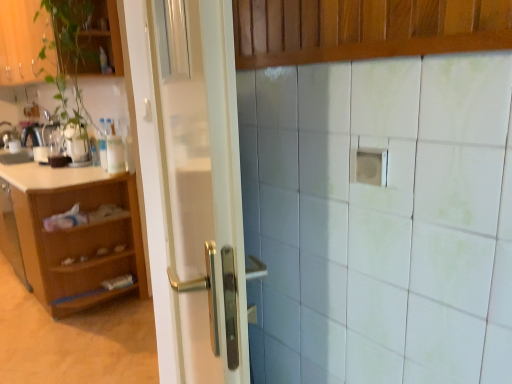
Question: From a real-world perspective, does green matte plant at upper left, acting as the 1th cabinetry starting from the top, sit lower than white glossy pot at left?

Choices:
 (A) no
 (B) yes

Answer: (A)

Question: Is green matte plant at upper left, which is the third cabinetry in bottom-to-top order, aimed at white glossy pot at left?

Choices:
 (A) no
 (B) yes

Answer: (A)

Question: Does green matte plant at upper left, which is the third cabinetry in bottom-to-top order, have a smaller size compared to white glossy pot at left?

Choices:
 (A) no
 (B) yes

Answer: (A)

Question: Does green matte plant at upper left, the second cabinetry in the back-to-front sequence, have a greater height compared to white glossy pot at left?

Choices:
 (A) no
 (B) yes

Answer: (B)

Question: Is white glossy pot at left located within green matte plant at upper left, which is counted as the second cabinetry, starting from the front?

Choices:
 (A) yes
 (B) no

Answer: (B)

Question: Would you consider green matte plant at upper left, the second cabinetry in the back-to-front sequence, to be distant from white glossy pot at left?

Choices:
 (A) no
 (B) yes

Answer: (A)

Question: From the image's perspective, would you say white glossy door at center is shown under wooden paneling at upper center, the 3th cabinetry when ordered from back to front?

Choices:
 (A) no
 (B) yes

Answer: (B)

Question: Can you confirm if white glossy door at center is thinner than wooden paneling at upper center, the 3th cabinetry when ordered from back to front?

Choices:
 (A) yes
 (B) no

Answer: (B)

Question: Considering the relative sizes of white glossy door at center and wooden paneling at upper center, placed as the 2th cabinetry when sorted from bottom to top, in the image provided, is white glossy door at center bigger than wooden paneling at upper center, placed as the 2th cabinetry when sorted from bottom to top,?

Choices:
 (A) no
 (B) yes

Answer: (B)

Question: Is white glossy door at center oriented away from wooden paneling at upper center, which is counted as the 2th cabinetry, starting from the top?

Choices:
 (A) no
 (B) yes

Answer: (B)

Question: Is white glossy door at center positioned in front of wooden paneling at upper center, which is counted as the 2th cabinetry, starting from the top?

Choices:
 (A) no
 (B) yes

Answer: (B)

Question: From a real-world perspective, is white glossy door at center beneath wooden paneling at upper center, placed as the 2th cabinetry when sorted from bottom to top?

Choices:
 (A) no
 (B) yes

Answer: (B)

Question: Considering the relative positions of white glossy sink at left and light brown wood cabinet at left, the 3th cabinetry in the front-to-back sequence, in the image provided, is white glossy sink at left to the left of light brown wood cabinet at left, the 3th cabinetry in the front-to-back sequence, from the viewer's perspective?

Choices:
 (A) yes
 (B) no

Answer: (A)